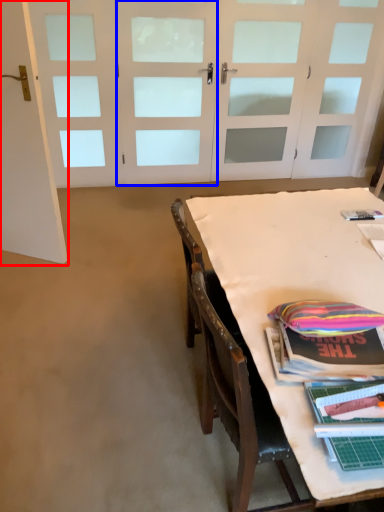
Question: Which object is closer to the camera taking this photo, door (highlighted by a red box) or door (highlighted by a blue box)?

Choices:
 (A) door
 (B) door

Answer: (A)